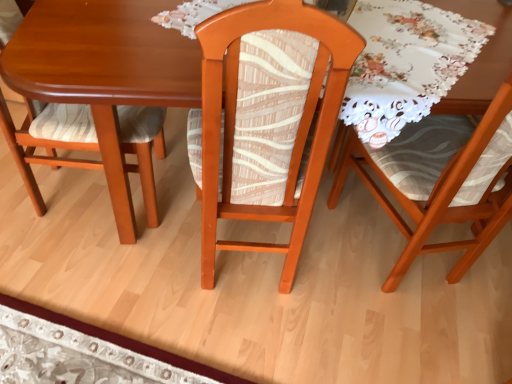
Locate an element on the screen. Image resolution: width=512 pixels, height=384 pixels. empty space that is in between wooden chair at center, which appears as the second chair when viewed from the right, and wooden chair at right, which ranks as the 3th chair in left-to-right order is located at coordinates (325, 259).